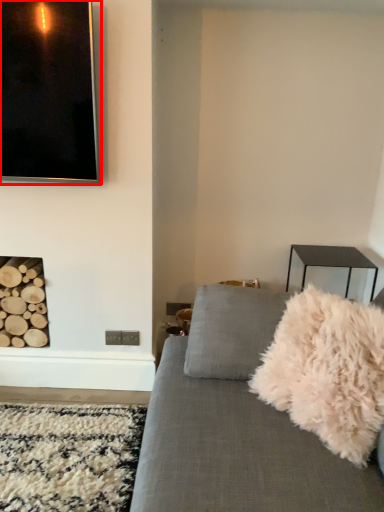
Question: From the image's perspective, considering the relative positions of picture frame (annotated by the red box) and throw pillow in the image provided, where is picture frame (annotated by the red box) located with respect to the staircase?

Choices:
 (A) below
 (B) above

Answer: (B)